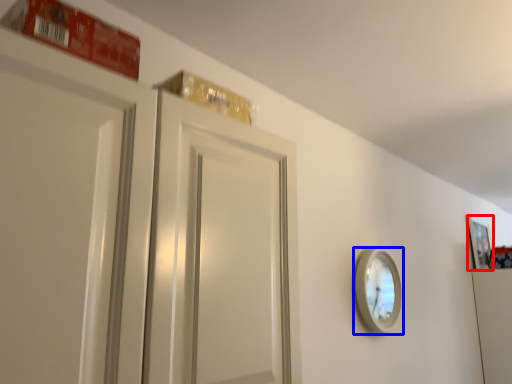
Question: Which of the following is the closest to the observer, picture frame (highlighted by a red box) or mirror (highlighted by a blue box)?

Choices:
 (A) picture frame
 (B) mirror

Answer: (B)